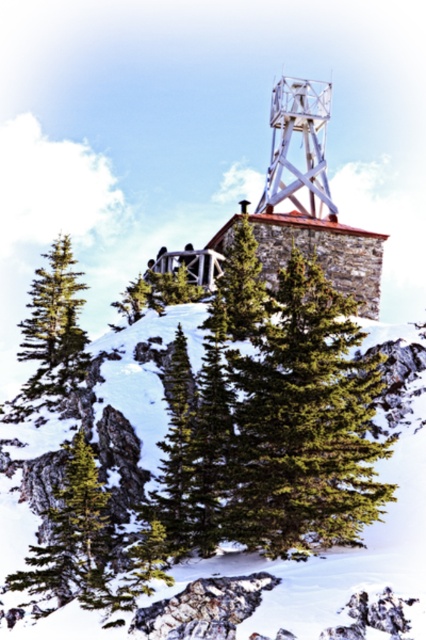
Question: Is green matte tree at lower left closer to the viewer compared to green matte evergreen tree at left?

Choices:
 (A) no
 (B) yes

Answer: (B)

Question: Which object is farther from the camera taking this photo?

Choices:
 (A) white fluffy snow at center
 (B) green matte tree at center

Answer: (B)

Question: Does white fluffy snow at center have a larger size compared to metallic white tower at upper center?

Choices:
 (A) yes
 (B) no

Answer: (A)

Question: Considering the relative positions of green matte evergreen tree at left and green matte tree at center in the image provided, where is green matte evergreen tree at left located with respect to green matte tree at center?

Choices:
 (A) left
 (B) right

Answer: (A)

Question: Estimate the real-world distances between objects in this image. Which object is closer to the green matte evergreen tree at left?

Choices:
 (A) metallic white tower at upper center
 (B) green matte tree at lower left
 (C) green matte tree at center

Answer: (C)

Question: Estimate the real-world distances between objects in this image. Which object is farther from the metallic white tower at upper center?

Choices:
 (A) green matte tree at center
 (B) green matte evergreen tree at left
 (C) green matte tree at lower left

Answer: (C)